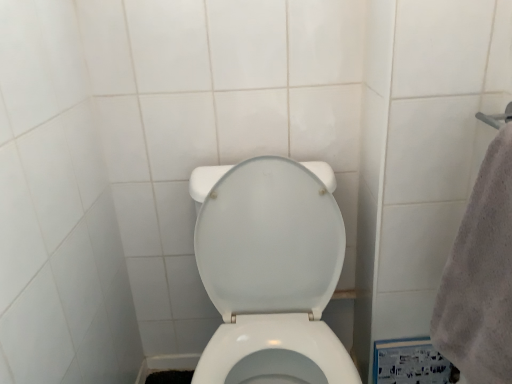
Question: Does white glossy toilet at center have a lesser height compared to gray fluffy towel at right?

Choices:
 (A) no
 (B) yes

Answer: (A)

Question: Could you tell me if white glossy toilet at center is turned towards gray fluffy towel at right?

Choices:
 (A) yes
 (B) no

Answer: (B)

Question: From a real-world perspective, is white glossy toilet at center located beneath gray fluffy towel at right?

Choices:
 (A) yes
 (B) no

Answer: (A)

Question: From a real-world perspective, does white glossy toilet at center stand above gray fluffy towel at right?

Choices:
 (A) no
 (B) yes

Answer: (A)

Question: Can you confirm if white glossy toilet at center is taller than gray fluffy towel at right?

Choices:
 (A) no
 (B) yes

Answer: (B)

Question: Does white glossy toilet at center appear on the right side of gray fluffy towel at right?

Choices:
 (A) yes
 (B) no

Answer: (B)

Question: Is gray fluffy towel at right positioned with its back to white glossy toilet at center?

Choices:
 (A) no
 (B) yes

Answer: (A)

Question: Is gray fluffy towel at right behind white glossy toilet at center?

Choices:
 (A) no
 (B) yes

Answer: (A)

Question: Can you confirm if gray fluffy towel at right is shorter than white glossy toilet at center?

Choices:
 (A) yes
 (B) no

Answer: (A)

Question: From the image's perspective, is gray fluffy towel at right over white glossy toilet at center?

Choices:
 (A) no
 (B) yes

Answer: (B)

Question: Is gray fluffy towel at right positioned far away from white glossy toilet at center?

Choices:
 (A) no
 (B) yes

Answer: (A)

Question: Is gray fluffy towel at right not within white glossy toilet at center?

Choices:
 (A) no
 (B) yes

Answer: (B)

Question: From a real-world perspective, is white glossy toilet at center above or below gray fluffy towel at right?

Choices:
 (A) above
 (B) below

Answer: (B)